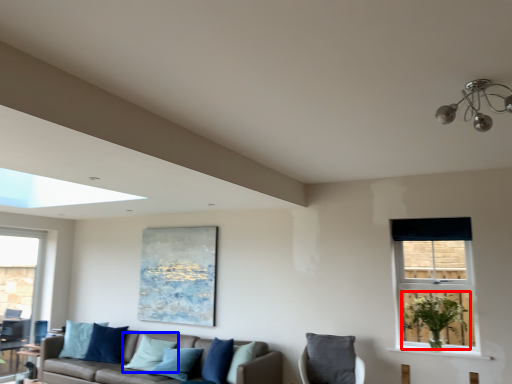
Question: Which of the following is the farthest to the observer, plant (highlighted by a red box) or pillow (highlighted by a blue box)?

Choices:
 (A) plant
 (B) pillow

Answer: (B)